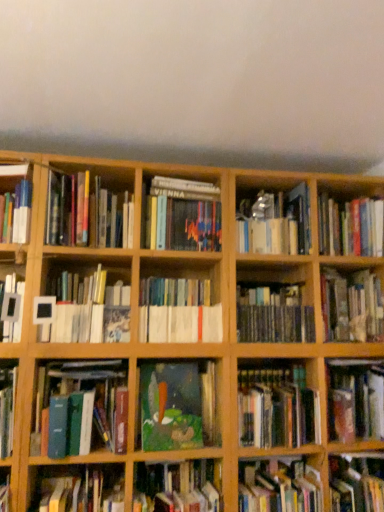
Question: Is metallic silver book at center, which is counted as the 11th book, starting from the left, looking in the opposite direction of hardcover book at center, positioned as the 9th book in left-to-right order?

Choices:
 (A) no
 (B) yes

Answer: (A)

Question: Are metallic silver book at center, which is counted as the 11th book, starting from the left, and hardcover book at center, positioned as the 9th book in left-to-right order, located far from each other?

Choices:
 (A) yes
 (B) no

Answer: (B)

Question: Can you confirm if metallic silver book at center, which is counted as the seventh book, starting from the right, is shorter than hardcover book at center, positioned as the 9th book in left-to-right order?

Choices:
 (A) yes
 (B) no

Answer: (B)

Question: From the image's perspective, does metallic silver book at center, which is counted as the 11th book, starting from the left, appear higher than hardcover book at center, positioned as the 9th book in left-to-right order?

Choices:
 (A) no
 (B) yes

Answer: (B)

Question: Considering the relative sizes of metallic silver book at center, which is counted as the 11th book, starting from the left, and hardcover book at center, positioned as the 9th book in left-to-right order, in the image provided, is metallic silver book at center, which is counted as the 11th book, starting from the left, smaller than hardcover book at center, positioned as the 9th book in left-to-right order,?

Choices:
 (A) yes
 (B) no

Answer: (B)

Question: Considering the positions of point pos(299,468) and point pos(205,360), is point pos(299,468) closer or farther from the camera than point pos(205,360)?

Choices:
 (A) farther
 (B) closer

Answer: (A)

Question: From the image's perspective, is hardcover book at lower right, the sixth book when ordered from right to left, located above or below oil painting at center, arranged as the 8th book when viewed from the left?

Choices:
 (A) above
 (B) below

Answer: (B)

Question: Relative to oil painting at center, marked as the tenth book in a right-to-left arrangement, is hardcover book at lower right, the 12th book from the left, in front or behind?

Choices:
 (A) behind
 (B) front

Answer: (B)

Question: In the image, is hardcover book at lower right, the sixth book when ordered from right to left, on the left side or the right side of oil painting at center, marked as the tenth book in a right-to-left arrangement?

Choices:
 (A) right
 (B) left

Answer: (A)

Question: From a real-world perspective, is hardcover book at lower left, the 4th book viewed from the left, positioned above or below hardcover book at center, placed as the sixteenth book when sorted from left to right?

Choices:
 (A) above
 (B) below

Answer: (B)

Question: Looking at the image, does hardcover book at lower left, positioned as the 14th book in right-to-left order, seem bigger or smaller compared to hardcover book at center, placed as the sixteenth book when sorted from left to right?

Choices:
 (A) big
 (B) small

Answer: (B)

Question: From the image's perspective, is hardcover book at lower left, the 4th book viewed from the left, above or below hardcover book at center, placed as the sixteenth book when sorted from left to right?

Choices:
 (A) above
 (B) below

Answer: (B)

Question: Looking at their shapes, would you say hardcover book at lower left, the 4th book viewed from the left, is wider or thinner than hardcover book at center, positioned as the second book in right-to-left order?

Choices:
 (A) thin
 (B) wide

Answer: (B)

Question: From the image's perspective, is hardcover book at center, positioned as the second book in right-to-left order, positioned above or below hardcover books at center, the twelfth book when ordered from right to left?

Choices:
 (A) above
 (B) below

Answer: (B)

Question: Considering the positions of point (374, 303) and point (216, 308), is point (374, 303) closer or farther from the camera than point (216, 308)?

Choices:
 (A) closer
 (B) farther

Answer: (B)